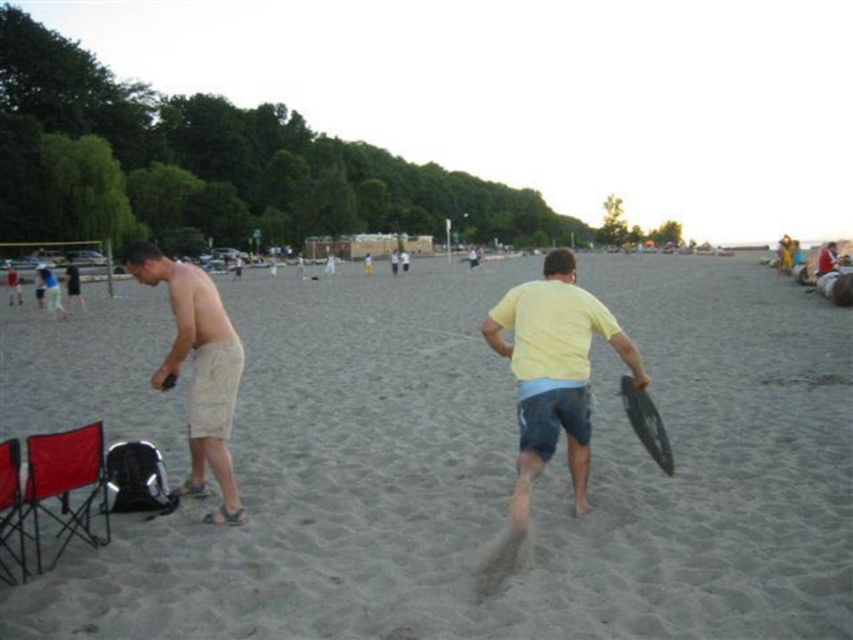
Question: Is yellow matte shirt at center to the right of beige cotton shorts at left from the viewer's perspective?

Choices:
 (A) yes
 (B) no

Answer: (A)

Question: Which object appears farthest from the camera in this image?

Choices:
 (A) gray sand at center
 (B) beige cotton shorts at left
 (C) yellow matte shirt at center

Answer: (B)

Question: Which object is positioned farthest from the beige cotton shorts at left?

Choices:
 (A) gray sand at center
 (B) yellow matte shirt at center

Answer: (A)

Question: Based on their relative distances, which object is farther from the beige cotton shorts at left?

Choices:
 (A) gray sand at center
 (B) yellow matte shirt at center

Answer: (A)

Question: Does gray sand at center come in front of beige cotton shorts at left?

Choices:
 (A) no
 (B) yes

Answer: (B)

Question: From the image, what is the correct spatial relationship of gray sand at center in relation to yellow matte shirt at center?

Choices:
 (A) below
 (B) above

Answer: (B)